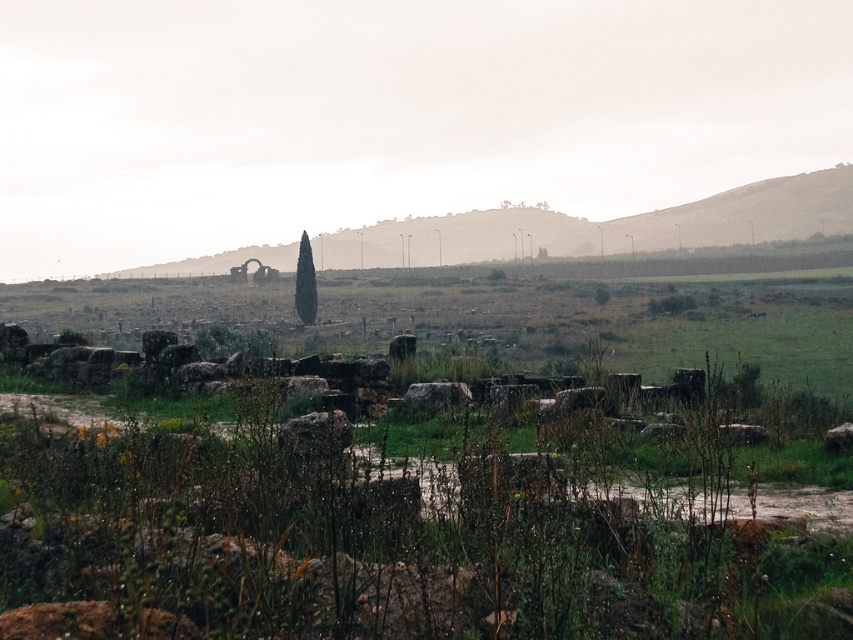
Question: Which point appears farthest from the camera in this image?

Choices:
 (A) (196, 268)
 (B) (309, 312)

Answer: (A)

Question: Can you confirm if rustic stone hillside at upper center is positioned above green leafy tree at center?

Choices:
 (A) yes
 (B) no

Answer: (A)

Question: Which point is farther from the camera taking this photo?

Choices:
 (A) (846, 211)
 (B) (312, 296)

Answer: (A)

Question: Observing the image, what is the correct spatial positioning of rustic stone hillside at upper center in reference to green leafy tree at center?

Choices:
 (A) below
 (B) above

Answer: (B)

Question: Which point is closer to the camera?

Choices:
 (A) (309, 308)
 (B) (445, 257)

Answer: (A)

Question: Does rustic stone hillside at upper center have a smaller size compared to green leafy tree at center?

Choices:
 (A) no
 (B) yes

Answer: (A)